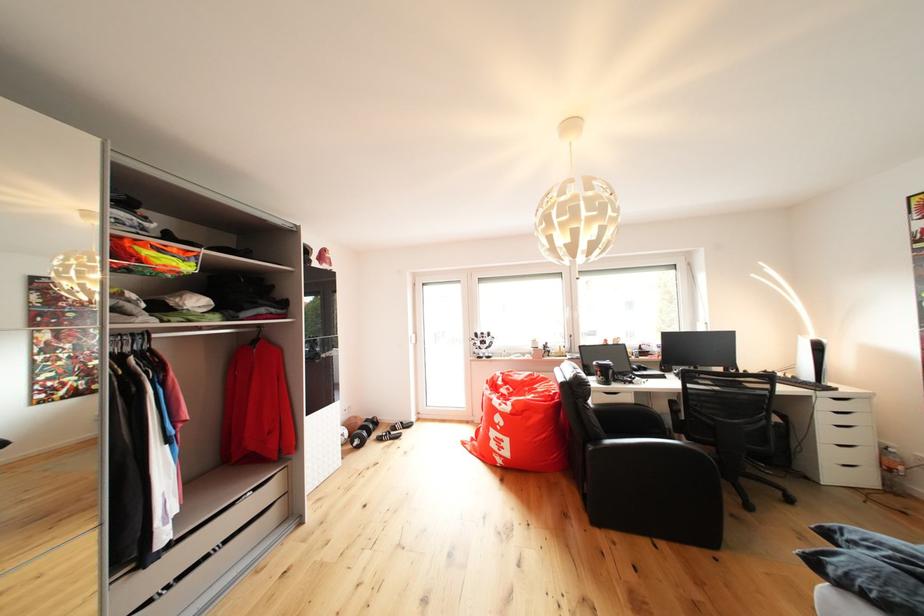
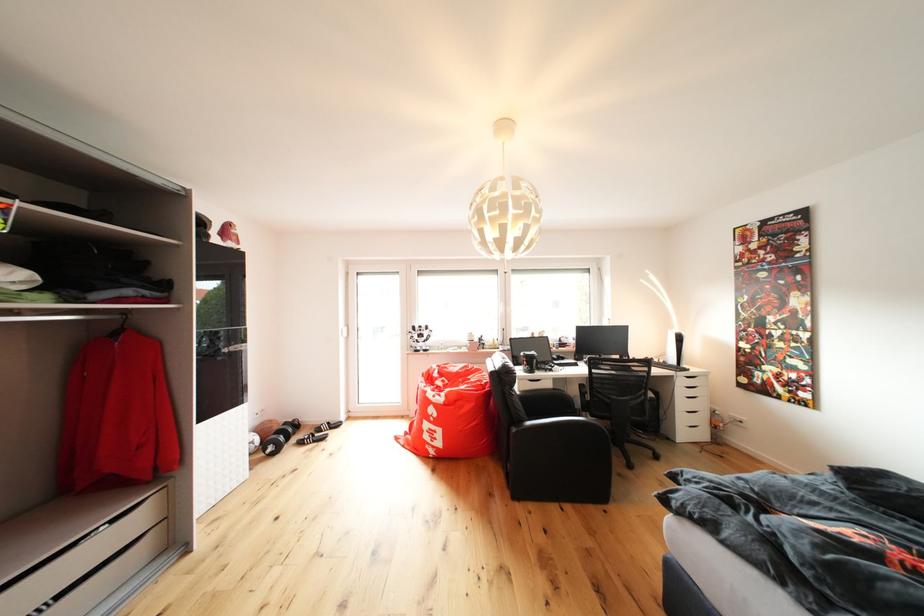
Question: The images are taken continuously from a first-person perspective. In which direction are you moving?

Choices:
 (A) Left
 (B) Right
 (C) Forward
 (D) Backward

Answer: (B)